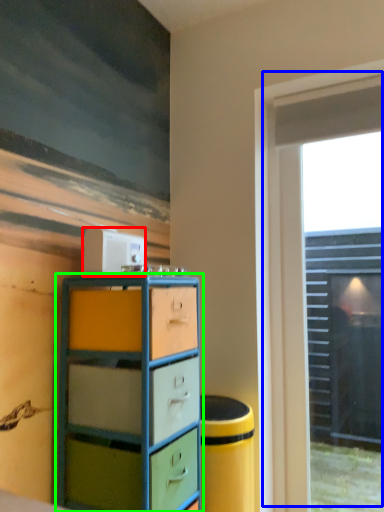
Question: Which object is positioned farthest from appliance (highlighted by a red box)? Select from window (highlighted by a blue box) and chest of drawers (highlighted by a green box).

Choices:
 (A) window
 (B) chest of drawers

Answer: (A)